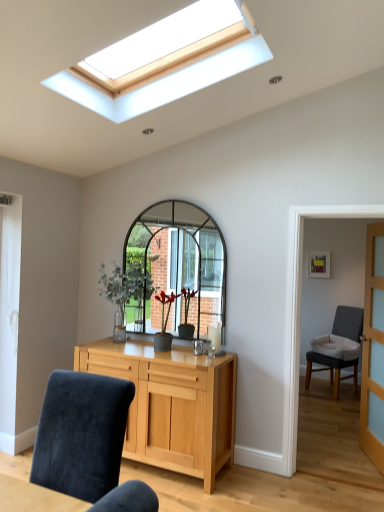
Question: Should I look upward or downward to see gray fabric chair at right, the 1th chair viewed from the right?

Choices:
 (A) down
 (B) up

Answer: (A)

Question: From a real-world perspective, is gray fabric chair at right, the 1th chair viewed from the right, located beneath light wood cabinet at center?

Choices:
 (A) no
 (B) yes

Answer: (A)

Question: Is gray fabric chair at right, positioned as the 1th chair in back-to-front order, not close to light wood cabinet at center?

Choices:
 (A) no
 (B) yes

Answer: (B)

Question: Can you confirm if gray fabric chair at right, positioned as the 1th chair in back-to-front order, is positioned to the right of light wood cabinet at center?

Choices:
 (A) yes
 (B) no

Answer: (A)

Question: Is light wood cabinet at center located within gray fabric chair at right, the 2th chair positioned from the front?

Choices:
 (A) yes
 (B) no

Answer: (B)

Question: Considering the relative sizes of gray fabric chair at right, the 1th chair viewed from the right, and light wood cabinet at center in the image provided, is gray fabric chair at right, the 1th chair viewed from the right, taller than light wood cabinet at center?

Choices:
 (A) no
 (B) yes

Answer: (B)

Question: Does gray fabric chair at right, the 1th chair viewed from the right, appear on the left side of light wood cabinet at center?

Choices:
 (A) yes
 (B) no

Answer: (B)

Question: Is gray fabric chair at right, the 1th chair viewed from the right, turned away from clear glass door at right?

Choices:
 (A) no
 (B) yes

Answer: (A)

Question: Considering the relative sizes of gray fabric chair at right, positioned as the 1th chair in back-to-front order, and clear glass door at right in the image provided, is gray fabric chair at right, positioned as the 1th chair in back-to-front order, wider than clear glass door at right?

Choices:
 (A) no
 (B) yes

Answer: (B)

Question: Does gray fabric chair at right, which ranks as the second chair in left-to-right order, come behind clear glass door at right?

Choices:
 (A) yes
 (B) no

Answer: (A)

Question: Can you confirm if gray fabric chair at right, the 2th chair positioned from the front, is smaller than clear glass door at right?

Choices:
 (A) yes
 (B) no

Answer: (B)

Question: Is clear glass door at right completely or partially inside gray fabric chair at right, which ranks as the second chair in left-to-right order?

Choices:
 (A) no
 (B) yes

Answer: (A)

Question: Is gray fabric chair at right, positioned as the 1th chair in back-to-front order, next to clear glass door at right?

Choices:
 (A) yes
 (B) no

Answer: (B)

Question: Is velvet blue chair at lower left, the second chair positioned from the right, to the left of gray fabric chair at right, the 2th chair positioned from the front, from the viewer's perspective?

Choices:
 (A) no
 (B) yes

Answer: (B)